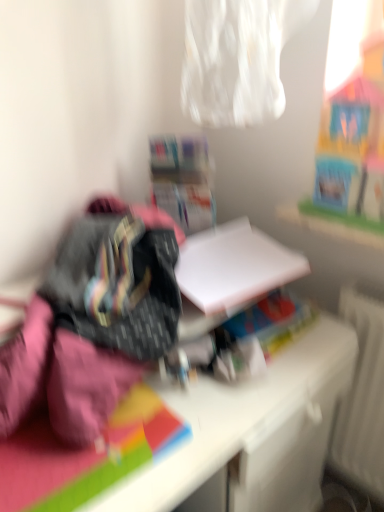
Question: From a real-world perspective, is white matte paper at center on top of white matte desk at center?

Choices:
 (A) yes
 (B) no

Answer: (A)

Question: From the image's perspective, is white matte paper at center above white matte desk at center?

Choices:
 (A) no
 (B) yes

Answer: (B)

Question: Is white matte paper at center thinner than white matte desk at center?

Choices:
 (A) yes
 (B) no

Answer: (A)

Question: Considering the relative sizes of white matte paper at center and white matte desk at center in the image provided, is white matte paper at center taller than white matte desk at center?

Choices:
 (A) yes
 (B) no

Answer: (B)

Question: From the image's perspective, is white matte paper at center located beneath white matte desk at center?

Choices:
 (A) yes
 (B) no

Answer: (B)

Question: Is white cardboard box at center in front of or behind white matte desk at center in the image?

Choices:
 (A) behind
 (B) front

Answer: (A)

Question: Is white cardboard box at center inside or outside of white matte desk at center?

Choices:
 (A) outside
 (B) inside

Answer: (A)

Question: From a real-world perspective, relative to white matte desk at center, is white cardboard box at center vertically above or below?

Choices:
 (A) below
 (B) above

Answer: (B)

Question: Is point (183, 153) closer or farther from the camera than point (125, 486)?

Choices:
 (A) farther
 (B) closer

Answer: (A)

Question: In terms of width, does white matte paper at center look wider or thinner when compared to white matte desk at center?

Choices:
 (A) thin
 (B) wide

Answer: (A)

Question: In terms of size, does white matte paper at center appear bigger or smaller than white matte desk at center?

Choices:
 (A) small
 (B) big

Answer: (A)

Question: Relative to white matte desk at center, is white matte paper at center in front or behind?

Choices:
 (A) front
 (B) behind

Answer: (B)

Question: In terms of height, does white matte paper at center look taller or shorter compared to white matte desk at center?

Choices:
 (A) short
 (B) tall

Answer: (A)

Question: From their relative heights in the image, would you say white matte desk at center is taller or shorter than white cardboard box at center?

Choices:
 (A) tall
 (B) short

Answer: (A)

Question: Considering the positions of white matte desk at center and white cardboard box at center in the image, is white matte desk at center wider or thinner than white cardboard box at center?

Choices:
 (A) thin
 (B) wide

Answer: (B)